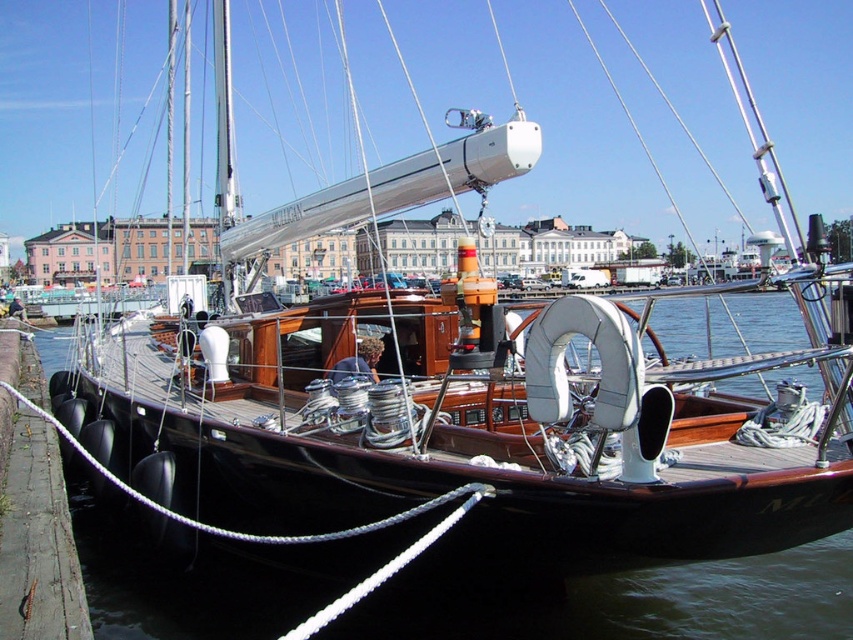
Question: Is black wood boat at center thinner than concrete at lower left?

Choices:
 (A) yes
 (B) no

Answer: (B)

Question: Is black wood boat at center wider than concrete at lower left?

Choices:
 (A) no
 (B) yes

Answer: (B)

Question: Which of the following is the farthest from the observer?

Choices:
 (A) concrete at lower left
 (B) black wood boat at center

Answer: (B)

Question: Which point is farther to the camera?

Choices:
 (A) concrete at lower left
 (B) black wood boat at center

Answer: (B)

Question: Which of the following is the farthest from the observer?

Choices:
 (A) (19, 595)
 (B) (715, 621)

Answer: (B)

Question: Is black wood boat at center thinner than concrete at lower left?

Choices:
 (A) no
 (B) yes

Answer: (A)